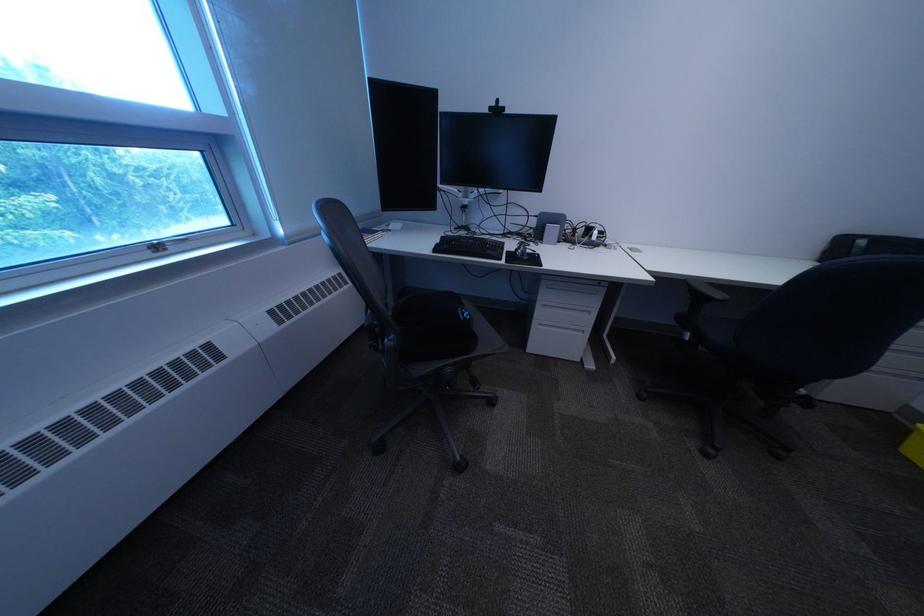
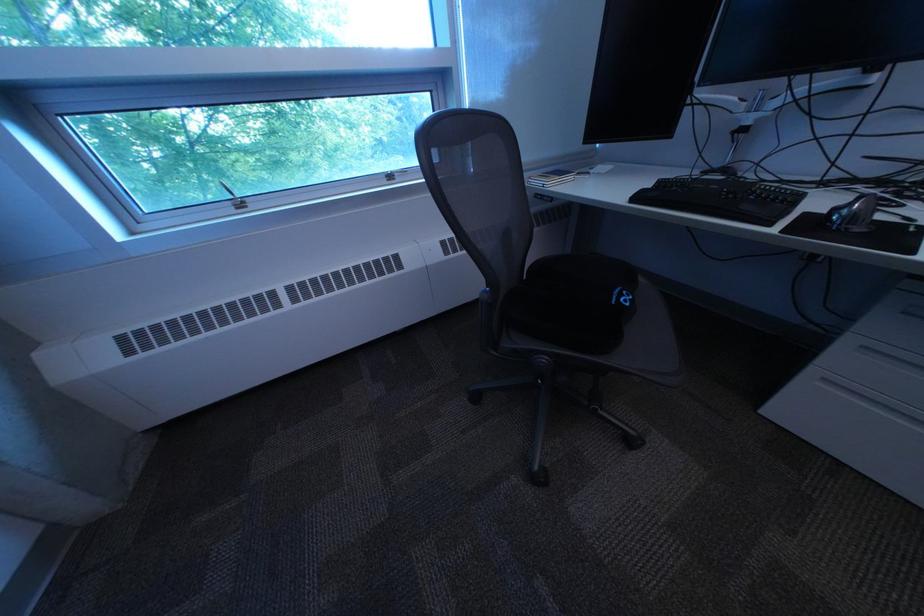
Question: How did the camera likely rotate?

Choices:
 (A) Left
 (B) Right
 (C) Up
 (D) Down

Answer: (A)